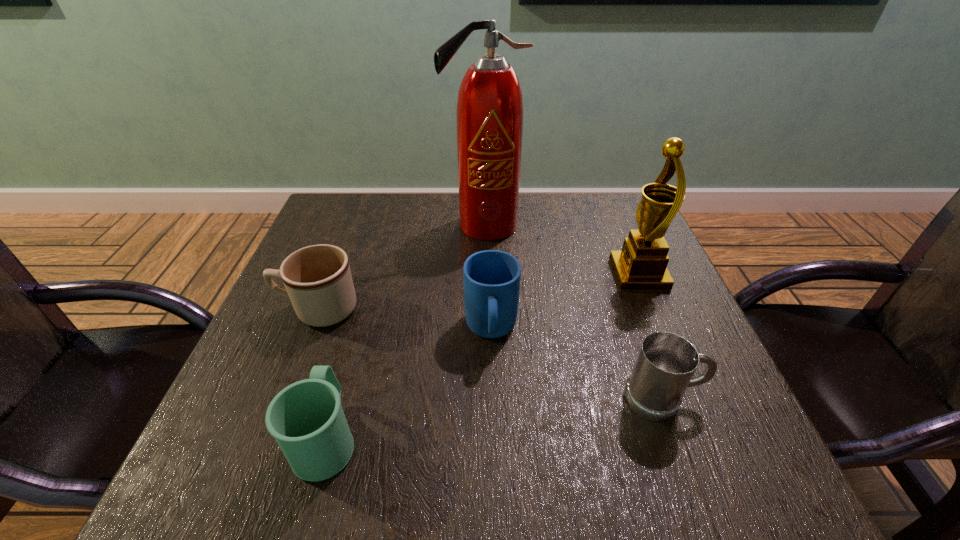
What are the coordinates of `free space at the near right corner` in the screenshot? It's located at (751, 492).

Identify the location of empty space that is in between the award and the second mug from right to left. This screenshot has width=960, height=540. coord(564,302).

Identify which object is located as the fourth nearest to the fire extinguisher. Please provide its 2D coordinates. Your answer should be formatted as a tuple, i.e. [(x, y)], where the tuple contains the x and y coordinates of a point satisfying the conditions above.

[(666, 362)]

Select which object appears as the fourth closest to the rightmost mug. Please provide its 2D coordinates. Your answer should be formatted as a tuple, i.e. [(x, y)], where the tuple contains the x and y coordinates of a point satisfying the conditions above.

[(306, 418)]

Locate which mug is the closest to the rightmost mug. Please provide its 2D coordinates. Your answer should be formatted as a tuple, i.e. [(x, y)], where the tuple contains the x and y coordinates of a point satisfying the conditions above.

[(491, 278)]

Select which mug appears as the third closest to the farthest object. Please provide its 2D coordinates. Your answer should be formatted as a tuple, i.e. [(x, y)], where the tuple contains the x and y coordinates of a point satisfying the conditions above.

[(666, 362)]

Where is `free point that satisfies the following two spatial constraints: 1. on the front-facing side of the award; 2. on the side of the third mug from left to right with the handle`? The image size is (960, 540). free point that satisfies the following two spatial constraints: 1. on the front-facing side of the award; 2. on the side of the third mug from left to right with the handle is located at coordinates (661, 330).